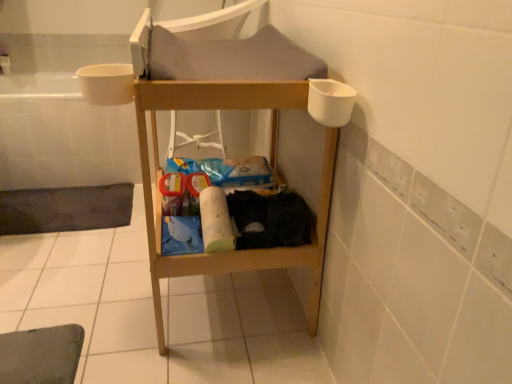
Identify the location of free space in front of dark gray mesh bath mat at lower left. (58, 262).